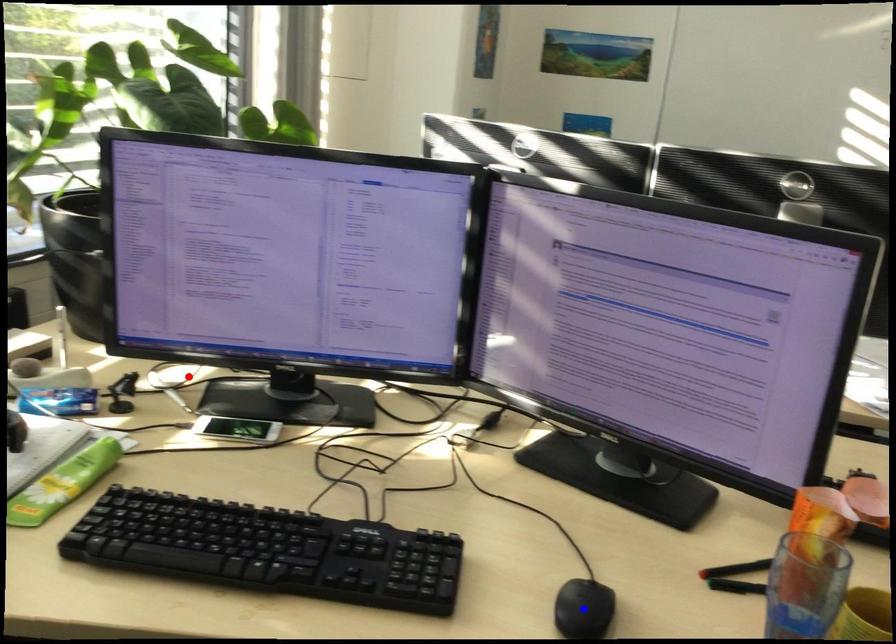
Question: Two points are marked on the image. Which point is closer to the camera?

Choices:
 (A) Blue point is closer.
 (B) Red point is closer.

Answer: (A)